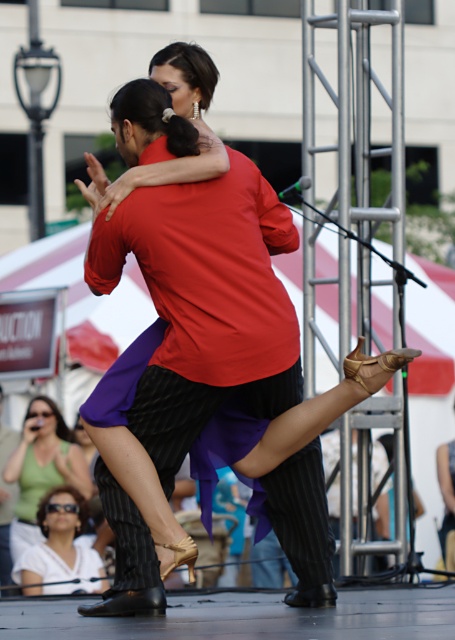
Question: Is matte red shirt at center wider than matte black dress at lower center?

Choices:
 (A) yes
 (B) no

Answer: (B)

Question: Considering the relative positions of matte black dress at lower center and white matte sunglasses at lower left in the image provided, where is matte black dress at lower center located with respect to white matte sunglasses at lower left?

Choices:
 (A) below
 (B) above

Answer: (B)

Question: Which point is farther to the camera?

Choices:
 (A) (137, 113)
 (B) (25, 548)
 (C) (54, 412)

Answer: (C)

Question: Can you confirm if matte red shirt at center is positioned to the right of matte black dress at lower center?

Choices:
 (A) yes
 (B) no

Answer: (A)

Question: Which of these objects is positioned closest to the matte black dress at lower center?

Choices:
 (A) white matte sunglasses at lower left
 (B) matte red shirt at center

Answer: (A)

Question: Which of the following is the closest to the observer?

Choices:
 (A) matte red shirt at center
 (B) matte black dress at lower center

Answer: (A)